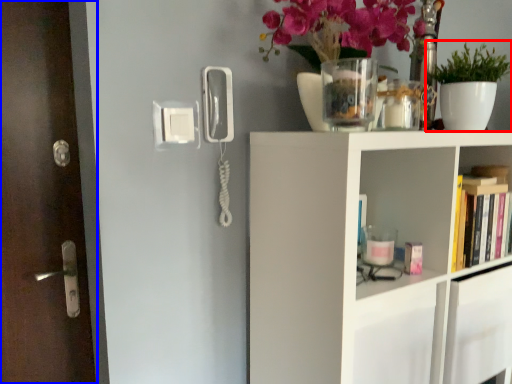
Question: Which object is further to the camera taking this photo, houseplant (highlighted by a red box) or door (highlighted by a blue box)?

Choices:
 (A) houseplant
 (B) door

Answer: (A)